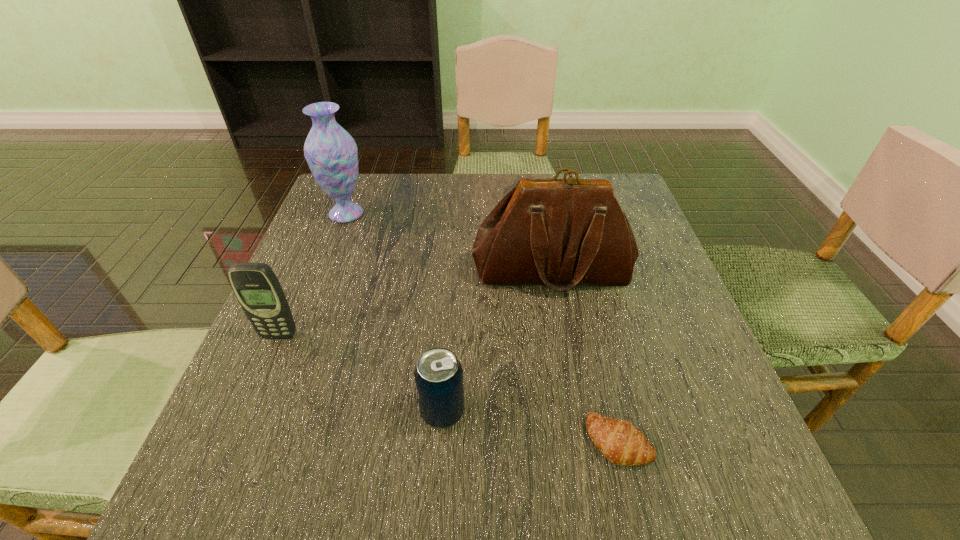
Find the location of a particular element. free space at the far edge of the desktop is located at coordinates (394, 200).

Locate an element on the screen. The height and width of the screenshot is (540, 960). blank area at the near edge is located at coordinates (583, 457).

In the image, there is a desktop. Find the location of `free space at the left edge`. free space at the left edge is located at coordinates (366, 236).

I want to click on free region at the right edge of the desktop, so click(713, 388).

Find the location of a particular element. free space at the far left corner of the desktop is located at coordinates (383, 190).

You are a GUI agent. You are given a task and a screenshot of the screen. Output one action in this format:
    pyautogui.click(x=<x>, y=<y>)
    Task: Click on the free space at the near left corner of the desktop
    The image size is (960, 540).
    Given the screenshot: What is the action you would take?
    pos(283,490)

Locate an element on the screen. The height and width of the screenshot is (540, 960). vacant space in between the soda can and the third shortest object is located at coordinates (361, 374).

Locate an element on the screen. free space between the third object from left to right and the vase is located at coordinates (395, 313).

Locate an element on the screen. This screenshot has width=960, height=540. empty space that is in between the farthest object and the third shortest object is located at coordinates (313, 275).

The height and width of the screenshot is (540, 960). Identify the location of empty space that is in between the cellular telephone and the vase. (313, 275).